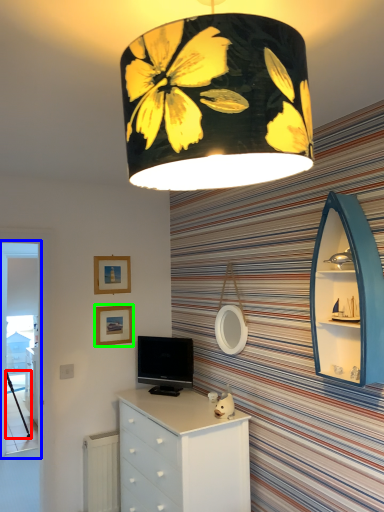
Question: Estimate the real-world distances between objects in this image. Which object is farther from tripod (highlighted by a red box), screen door (highlighted by a blue box) or picture frame (highlighted by a green box)?

Choices:
 (A) screen door
 (B) picture frame

Answer: (B)